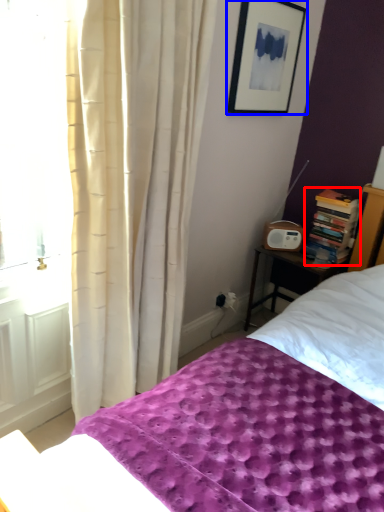
Question: Which point is closer to the camera, book (highlighted by a red box) or picture frame (highlighted by a blue box)?

Choices:
 (A) book
 (B) picture frame

Answer: (B)